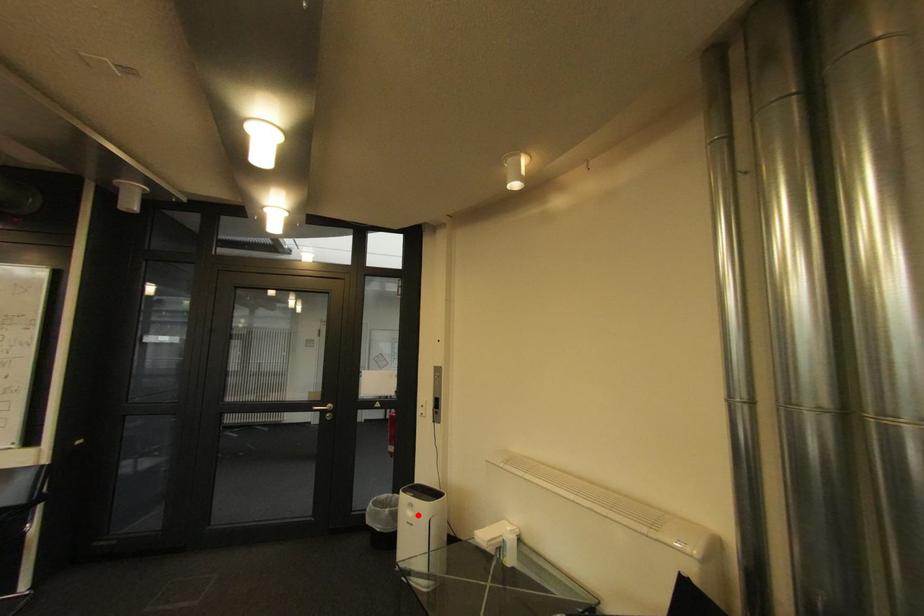
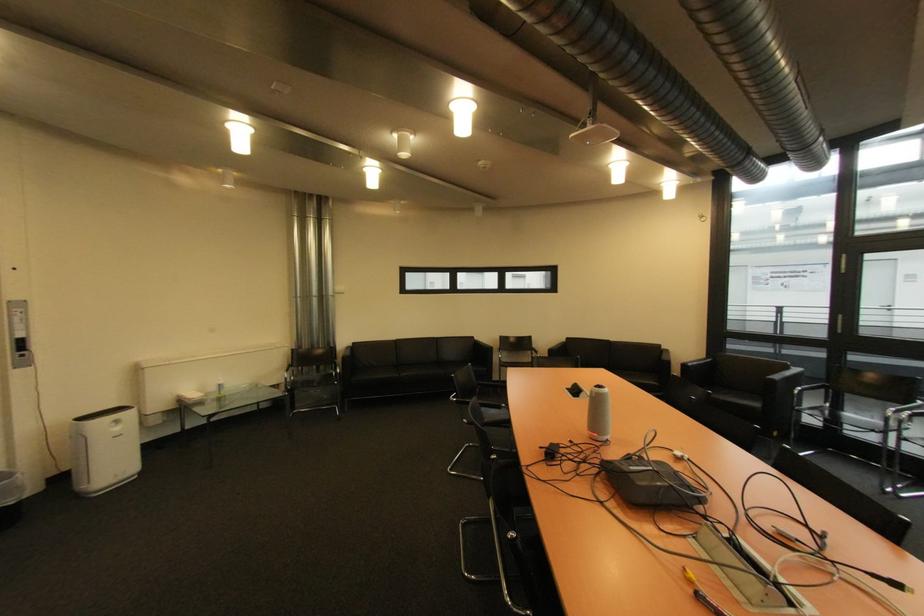
Question: I am providing you with two images of the same scene from different viewpoints. A red point is marked on the first image. Is the red point's position out of view in image 2?

Choices:
 (A) Yes
 (B) No

Answer: (B)